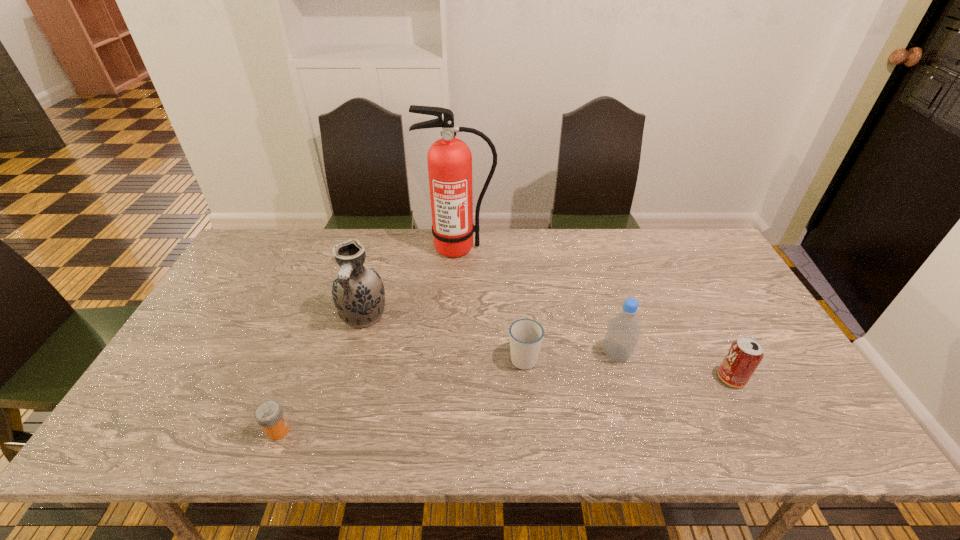
You are a GUI agent. You are given a task and a screenshot of the screen. Output one action in this format:
    pyautogui.click(x=<x>, y=<y>)
    Task: Click on the free space located 0.290m on the handle side of the tallest object
    Image resolution: width=960 pixels, height=540 pixels.
    Given the screenshot: What is the action you would take?
    click(x=454, y=326)

Where is `vacant space situated 0.200m with the handle on the side of the second object from left to right`? This screenshot has width=960, height=540. vacant space situated 0.200m with the handle on the side of the second object from left to right is located at coordinates (341, 400).

You are a GUI agent. You are given a task and a screenshot of the screen. Output one action in this format:
    pyautogui.click(x=<x>, y=<y>)
    Task: Click on the vacant space located on the right of the bottle
    This screenshot has width=960, height=540.
    Given the screenshot: What is the action you would take?
    pyautogui.click(x=773, y=354)

This screenshot has height=540, width=960. In order to click on vacant space situated 0.180m on the back of the soda can in this screenshot , I will do `click(699, 316)`.

In order to click on vacant region located with a handle on the side of the fourth object from left to right in this screenshot , I will do `click(516, 275)`.

What are the coordinates of `vacant space located 0.370m with a handle on the side of the fourth object from left to right` in the screenshot? It's located at (515, 257).

Identify the location of vacant region located 0.330m with a handle on the side of the fourth object from left to right. (515, 265).

Find the location of a particular element. This screenshot has height=540, width=960. vacant point located on the label side of the nearest object is located at coordinates (455, 431).

Identify the location of object that is at the far edge. (449, 159).

The image size is (960, 540). Identify the location of object present at the near edge. (269, 414).